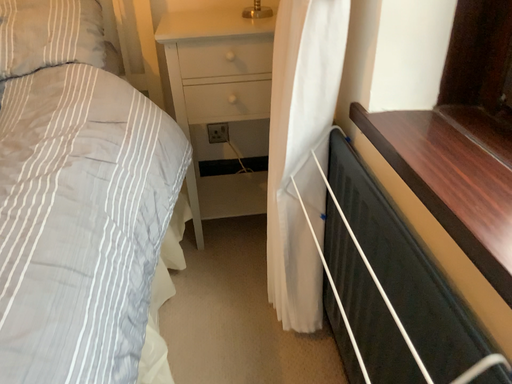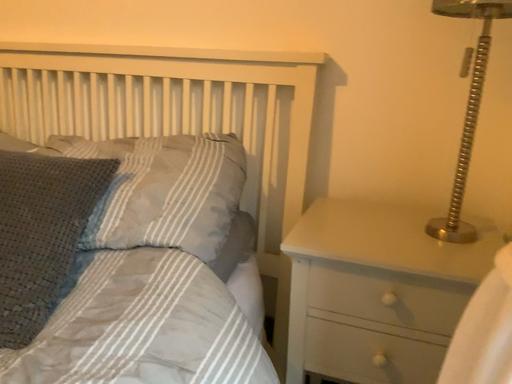
Question: How did the camera likely rotate when shooting the video?

Choices:
 (A) rotated downward
 (B) rotated upward

Answer: (B)